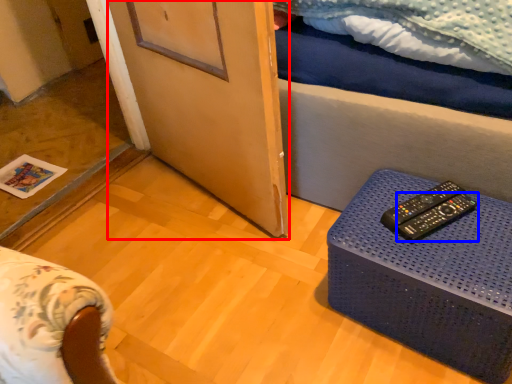
Question: Which object appears closest to the camera in this image, screen door (highlighted by a red box) or remote control (highlighted by a blue box)?

Choices:
 (A) screen door
 (B) remote control

Answer: (A)